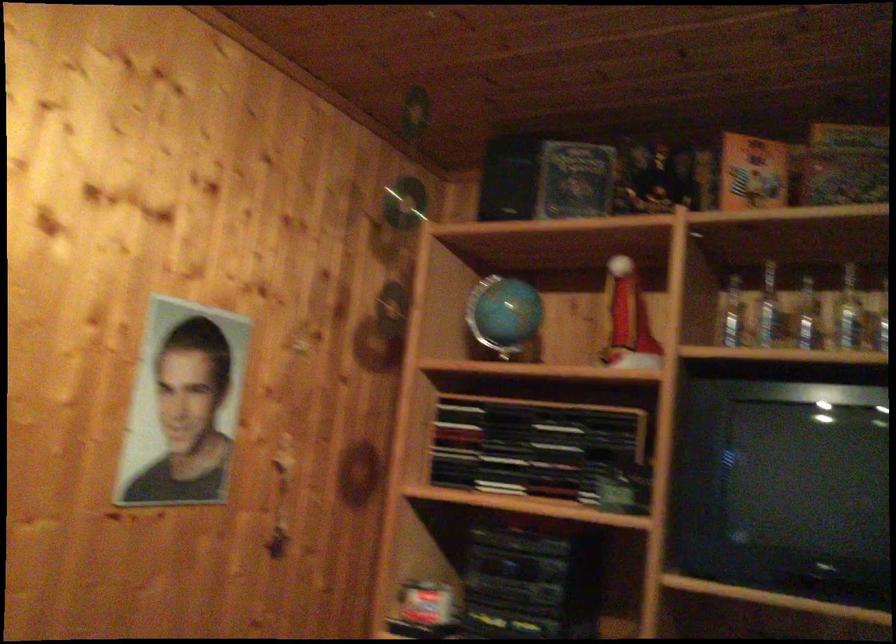
What do you see at coordinates (803, 314) in the screenshot? I see `the glass trophy` at bounding box center [803, 314].